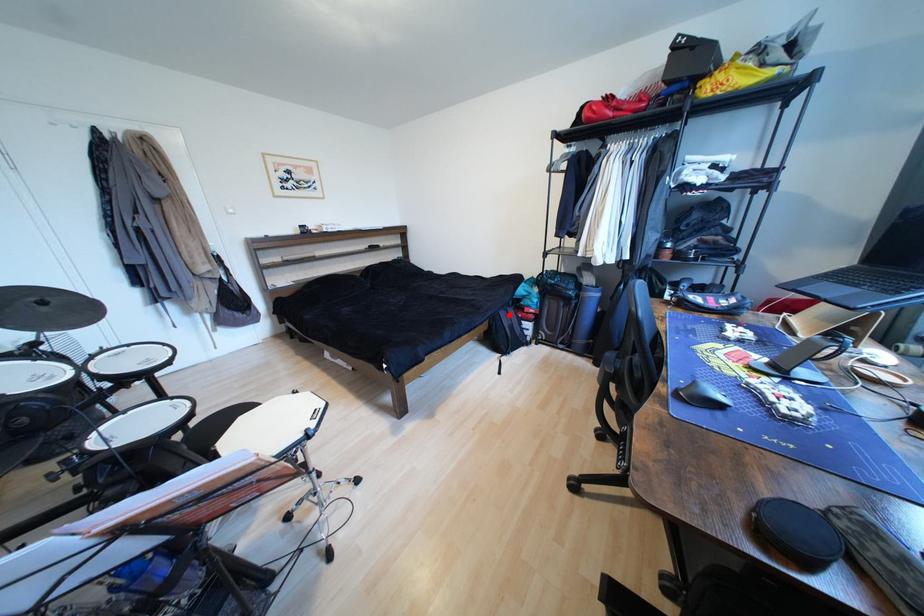
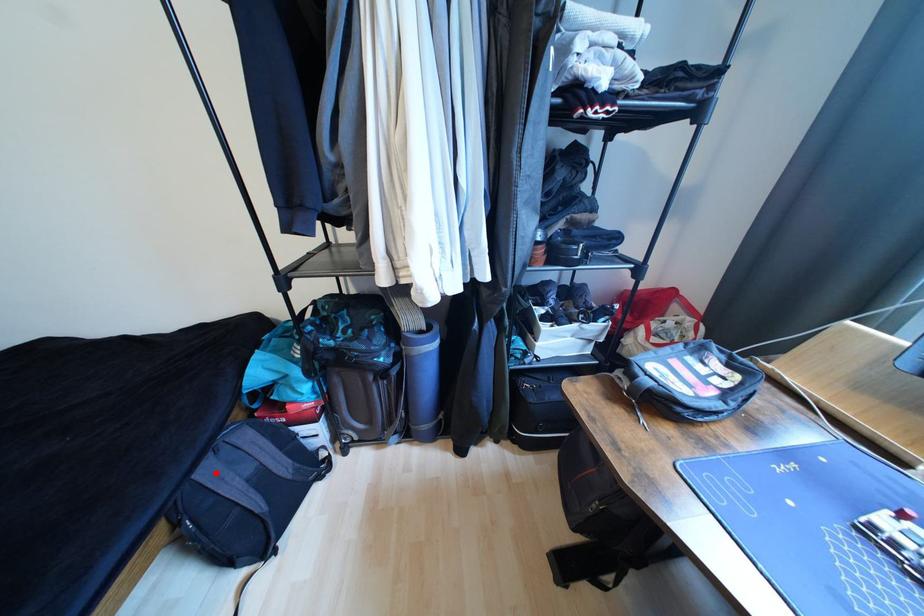
I am providing you with two images of the same scene from different viewpoints. A red point is marked on the first image and another point is marked on the second image. Is the marked point in image1 the same physical position as the marked point in image2?

Yes